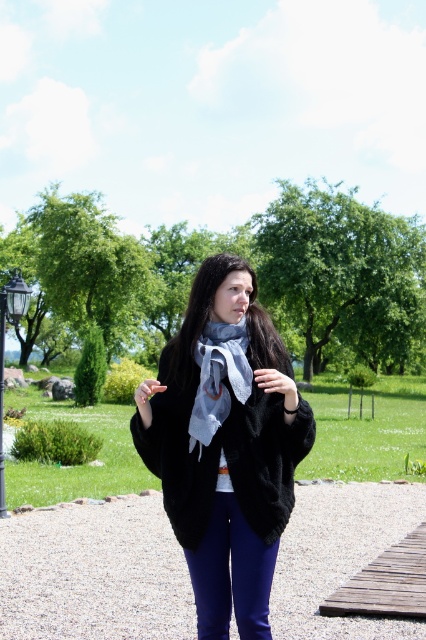
You are a gardener trying to place a new decorative stone that is 2 feet wide. You see the gravel at center and the black metal lamp post at lower left in the park. Which location can accommodate the stone without exceeding its width?

The black metal lamp post at lower left can accommodate the stone since the gravel at center has a lesser width and cannot fit the 2 feet wide stone.

You are taking a photo of the person in the park. The camera is at your eye level. You want to focus on the point closest to you. Which point should you choose between point (215, 602) and point (3, 292)?

Point (215, 602) is closer to the camera than point (3, 292), so you should choose point (215, 602) to focus on the point closest to you.